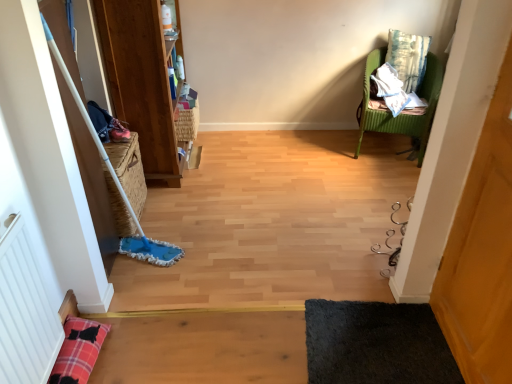
Question: Are black shaggy rug at lower right and white textured radiator at lower left located far from each other?

Choices:
 (A) yes
 (B) no

Answer: (A)

Question: Is black shaggy rug at lower right facing towards white textured radiator at lower left?

Choices:
 (A) no
 (B) yes

Answer: (A)

Question: Is black shaggy rug at lower right closer to the viewer compared to white textured radiator at lower left?

Choices:
 (A) no
 (B) yes

Answer: (A)

Question: Is black shaggy rug at lower right thinner than white textured radiator at lower left?

Choices:
 (A) yes
 (B) no

Answer: (B)

Question: Does black shaggy rug at lower right lie behind white textured radiator at lower left?

Choices:
 (A) yes
 (B) no

Answer: (A)

Question: From a real-world perspective, is black shaggy rug at lower right under white textured radiator at lower left?

Choices:
 (A) yes
 (B) no

Answer: (A)

Question: Would you say woven brown basket at upper center, positioned as the second basket in left-to-right order, is outside woven straw basket at left, the second basket from the right?

Choices:
 (A) no
 (B) yes

Answer: (B)

Question: Can you confirm if woven brown basket at upper center, the first basket when ordered from right to left, is thinner than woven straw basket at left, which ranks as the 1th basket in left-to-right order?

Choices:
 (A) yes
 (B) no

Answer: (A)

Question: Is woven brown basket at upper center, positioned as the second basket in left-to-right order, with woven straw basket at left, which ranks as the 1th basket in left-to-right order?

Choices:
 (A) yes
 (B) no

Answer: (B)

Question: Is woven brown basket at upper center, the first basket when ordered from right to left, oriented towards woven straw basket at left, which is the 2th basket from top to bottom?

Choices:
 (A) yes
 (B) no

Answer: (B)

Question: Is woven brown basket at upper center, positioned as the second basket in left-to-right order, further to the viewer compared to woven straw basket at left, which is the 2th basket from top to bottom?

Choices:
 (A) no
 (B) yes

Answer: (B)

Question: Is woven brown basket at upper center, positioned as the second basket in left-to-right order, turned away from woven straw basket at left, the 2th basket in the back-to-front sequence?

Choices:
 (A) yes
 (B) no

Answer: (B)

Question: Considering the relative positions of woven straw basket at left, the second basket from the right, and textured blue-green pillow at upper right in the image provided, is woven straw basket at left, the second basket from the right, to the left of textured blue-green pillow at upper right from the viewer's perspective?

Choices:
 (A) no
 (B) yes

Answer: (B)